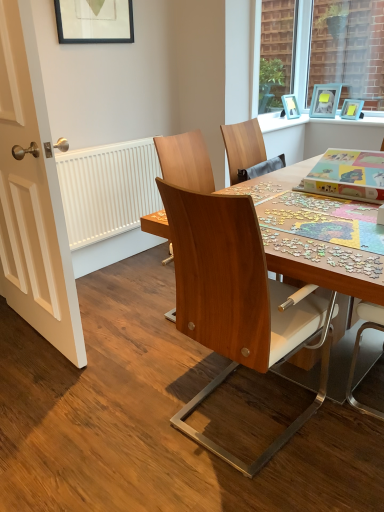
Image resolution: width=384 pixels, height=512 pixels. I want to click on free space in front of white matte radiator at left, so click(x=121, y=285).